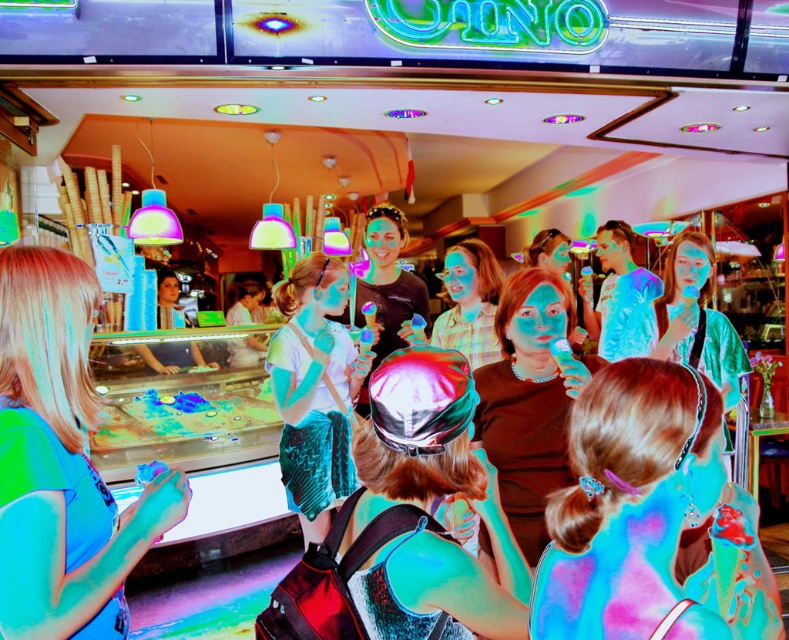
From the picture: You are standing in the ice cream shop and want to reach both the point at coordinates point (696,464) and the point at coordinates point (13,486). Which point should you reach first to minimize the distance walked?

You should reach point (696,464) first because it is closer to you than point (13,486), so reaching it first will save walking distance.

You are a customer in the ice cream shop and want to order a dessert. You notice two items at the center of the menu board. One is a dessert with shiny blue hair at center, and the other is a dessert with velvet teal skirt at center. Which dessert is taller?

The velvet teal skirt at center is taller than the shiny blue hair at center, so the dessert with the velvet teal skirt at center is taller.